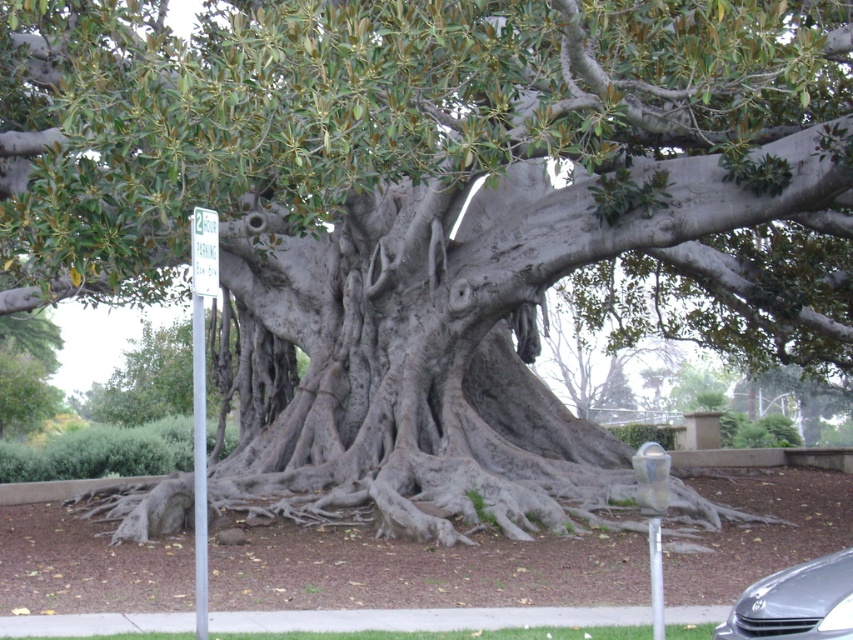
You are a pedestrian standing near the tree. You want to park your car where the metallic gray car at lower right is currently parked. However, you notice the white plastic sign at left. What should you consider before parking there?

The metallic gray car at lower right is below the white plastic sign at left, so you should check if the sign indicates any parking restrictions or regulations for that area.

You are standing at the base of the tree and want to walk towards the car in the bottom right corner. There are two points marked on the ground. One is point (775, 595) and the other is point (216, 241). Which point is closer to your current position?

Point (775, 595) is closer to your current position because it is in front of point (216, 241), meaning it is nearer to the base of the tree where you are standing.

You are a pedestrian standing at the base of the tree. You need to walk to the metallic gray car at lower right but must avoid the white plastic parking sign at upper left. Which direction should you walk to reach the car without passing near the sign?

The metallic gray car at lower right is to the right of the white plastic parking sign at upper left. To reach the car without passing near the sign, walk towards the right side of the tree, away from the sign.